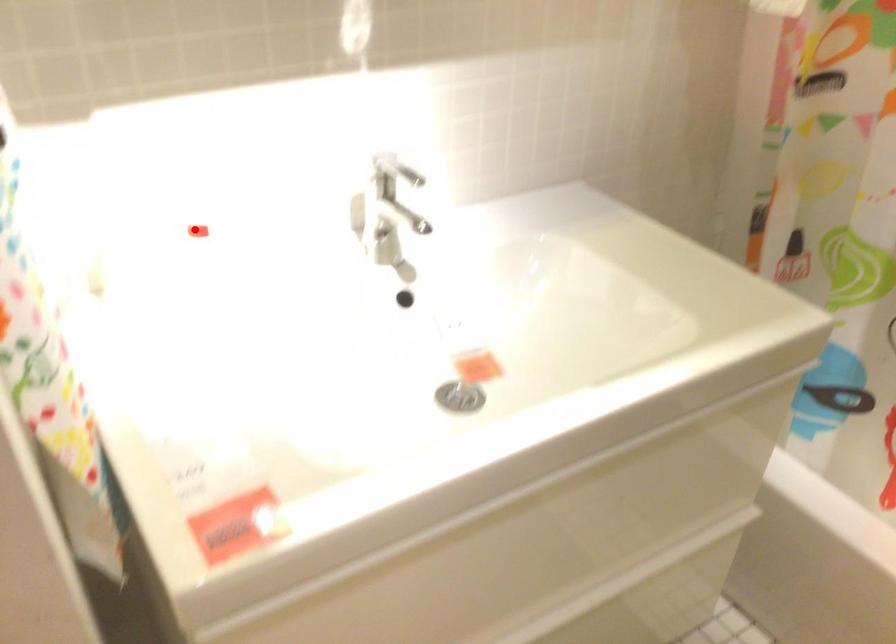
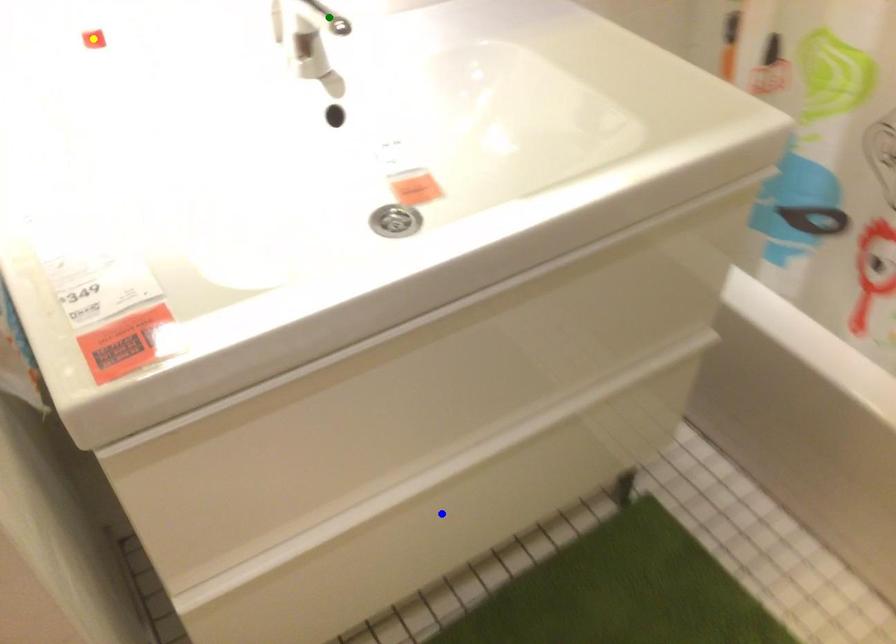
Question: I am providing you with two images of the same scene from different viewpoints. A red point is marked on the first image. You are given multiple points on the second image. Which point in image 2 is actually the same real-world point as the red point in image 1?

Choices:
 (A) blue point
 (B) yellow point
 (C) green point

Answer: (B)